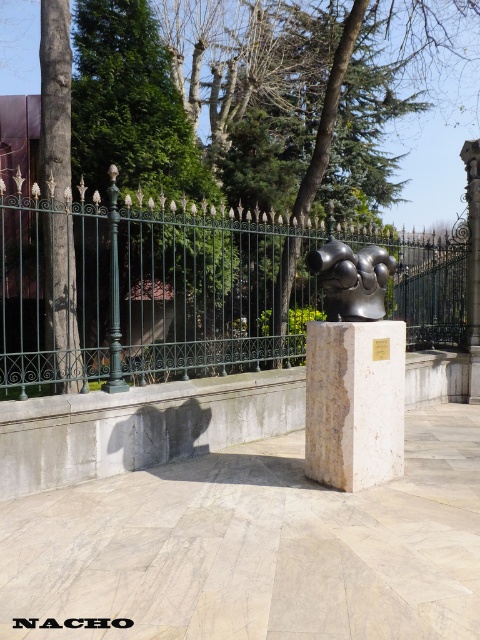
You are a landscape architect designing a pathway between the white marble pillar at center and the smooth bark tree at left. Which object should the path be wider near to accommodate its size?

The path should be wider near the white marble pillar at center because its width surpasses that of the smooth bark tree at left.

You are standing in a park and see the green wrought iron fence at center and the polished bronze sculpture at center. Which object is positioned to the left of the other?

The green wrought iron fence at center is to the left of the polished bronze sculpture at center.

You are standing at the center of the sculpture garden and see the point marked at coordinate (149, 292). What object is located at that point?

The green wrought iron fence at center is located at point (149, 292).